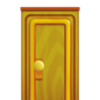
You are a GUI agent. You are given a task and a screenshot of the screen. Output one action in this format:
    pyautogui.click(x=<x>, y=<y>)
    Task: Click on the wood panel
    The image size is (100, 100).
    Given the screenshot: What is the action you would take?
    pyautogui.click(x=39, y=76)